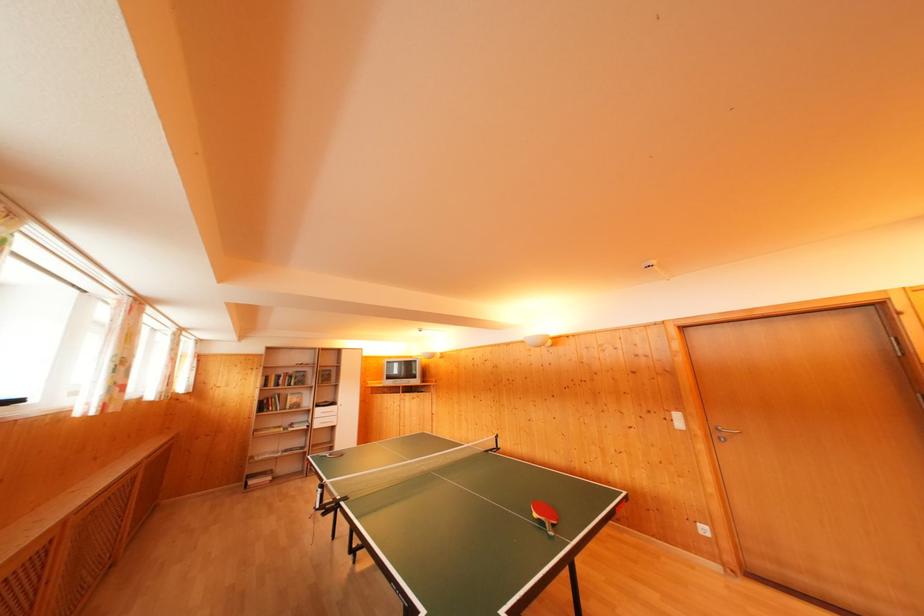
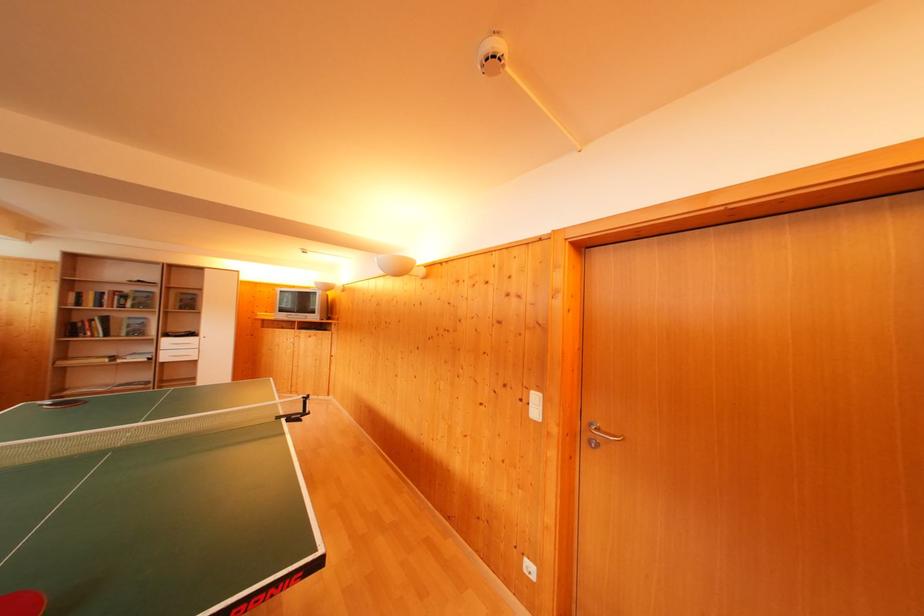
In the second image, find the point that corresponds to [685,430] in the first image.

(541, 418)